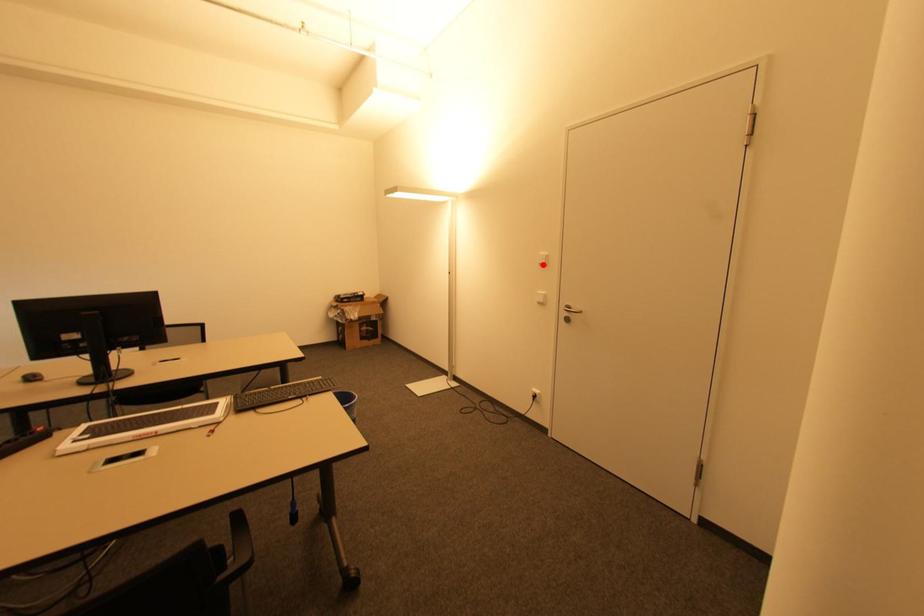
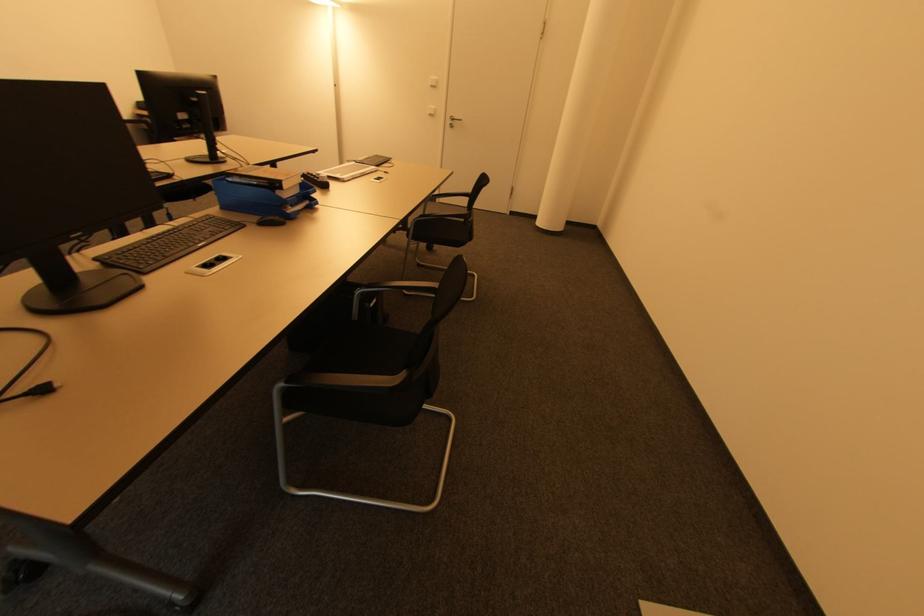
Question: I am providing you with two images of the same scene from different viewpoints. In image1, a red point is highlighted. Considering the same 3D point in image2, which of the following is correct?

Choices:
 (A) It is closer
 (B) It is farther

Answer: (A)